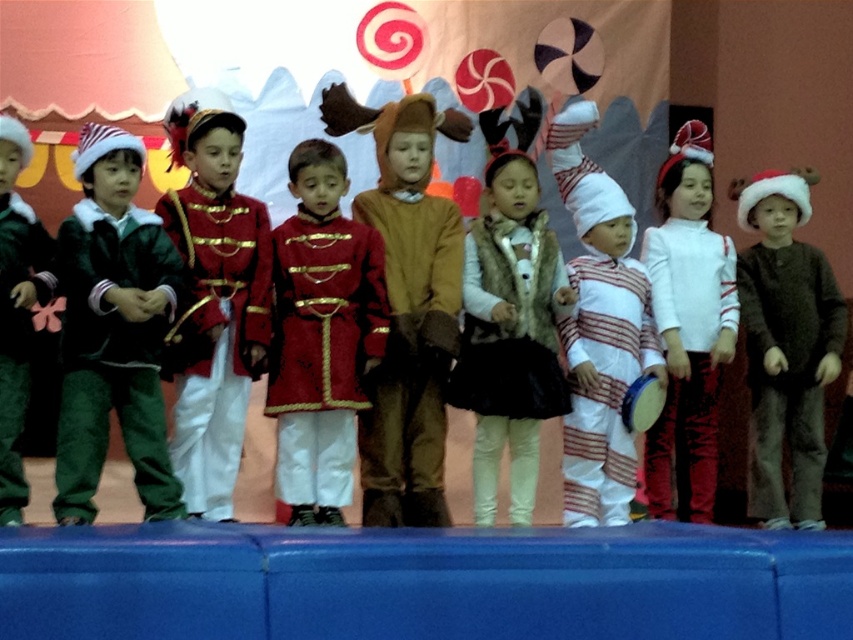
Question: Does white striped fabric at center have a smaller size compared to matte green pants at left?

Choices:
 (A) yes
 (B) no

Answer: (A)

Question: Which is nearer to the white matte dress at center?

Choices:
 (A) shiny red uniform at center
 (B) brown fuzzy sweater at center
 (C) shiny red coat at center

Answer: (B)

Question: Which of the following is the closest to the observer?

Choices:
 (A) shiny red uniform at center
 (B) brown fuzzy sweater at center
 (C) green fabric coat at left
 (D) fuzzy brown vest at center

Answer: (C)

Question: Does brown wool sweater at center appear on the left side of white striped fabric at center?

Choices:
 (A) yes
 (B) no

Answer: (B)

Question: Does brown fuzzy sweater at center appear over white striped fabric at center?

Choices:
 (A) no
 (B) yes

Answer: (A)

Question: Which object appears farthest from the camera in this image?

Choices:
 (A) white striped fabric at center
 (B) green fabric coat at left
 (C) fuzzy brown vest at center

Answer: (A)